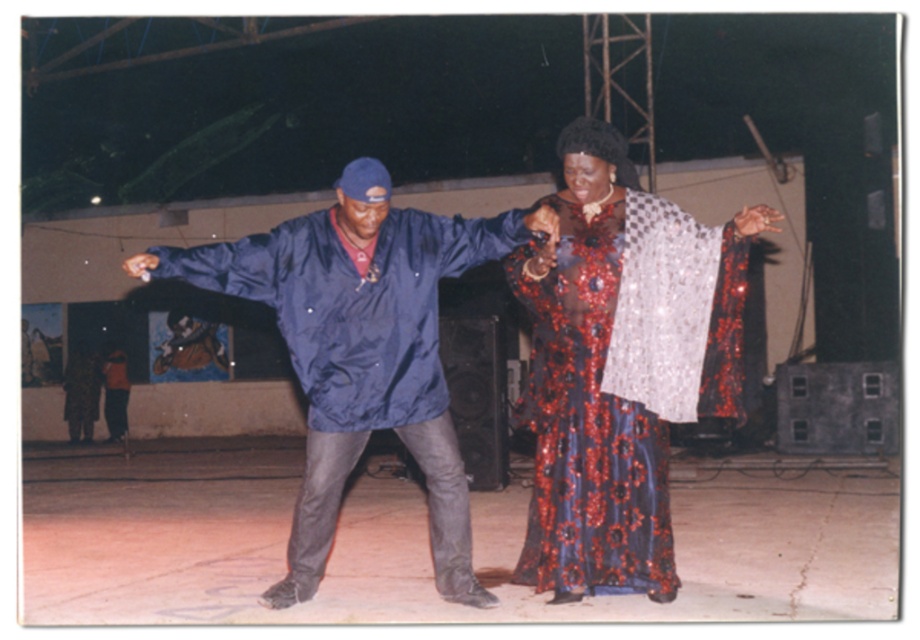
Who is taller, shiny blue jacket at center or orange fabric dress at lower left?

shiny blue jacket at center

Find the location of a particular element. shiny blue jacket at center is located at coordinates (362, 349).

Find the location of a particular element. shiny blue jacket at center is located at coordinates (362, 349).

Who is shorter, shiny sequined dress at center or orange fabric dress at lower left?

With less height is orange fabric dress at lower left.

Does shiny sequined dress at center appear on the left side of orange fabric dress at lower left?

No, shiny sequined dress at center is not to the left of orange fabric dress at lower left.

You are a GUI agent. You are given a task and a screenshot of the screen. Output one action in this format:
    pyautogui.click(x=<x>, y=<y>)
    Task: Click on the shiny sequined dress at center
    
    Given the screenshot: What is the action you would take?
    pyautogui.click(x=588, y=392)

Where is `shiny sequined dress at center`? This screenshot has width=920, height=640. shiny sequined dress at center is located at coordinates (588, 392).

Does shiny blue jacket at center have a smaller size compared to shiny sequined dress at center?

No.

In the scene shown: Which is more to the right, shiny blue jacket at center or shiny sequined dress at center?

From the viewer's perspective, shiny sequined dress at center appears more on the right side.

Does point (277, 307) come farther from viewer compared to point (621, 531)?

No, it is in front of (621, 531).

The image size is (920, 640). In order to click on shiny blue jacket at center in this screenshot , I will do `click(362, 349)`.